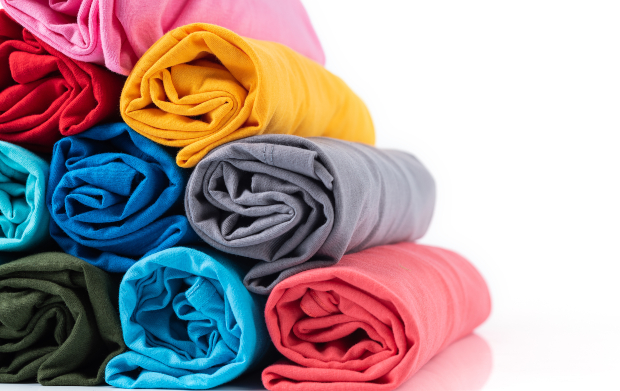
The image size is (620, 391). What are the coordinates of `folded multicolored blankets` in the screenshot? It's located at (102, 27), (37, 71), (229, 93), (14, 166), (91, 172), (369, 319), (214, 309), (56, 300).